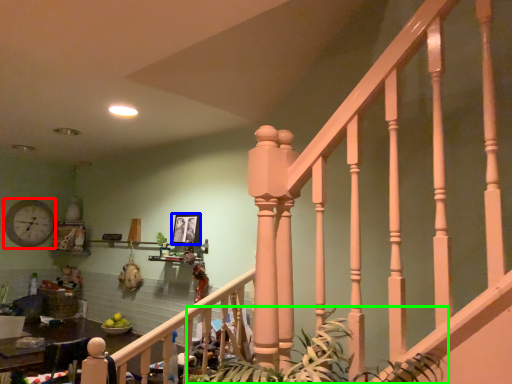
Question: Considering the real-world distances, which object is farthest from clock (highlighted by a red box)? picture frame (highlighted by a blue box) or plant (highlighted by a green box)?

Choices:
 (A) picture frame
 (B) plant

Answer: (B)